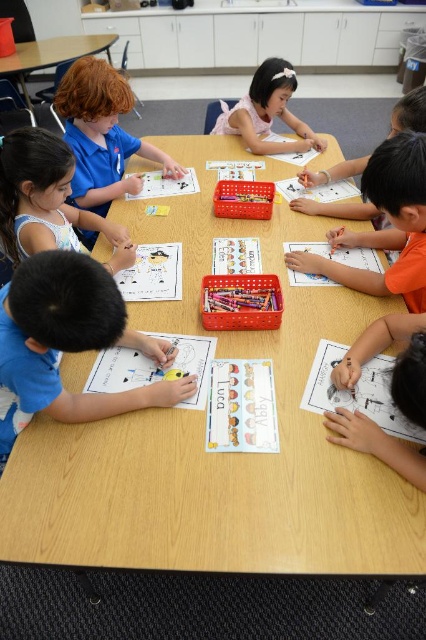
Question: Can you confirm if pink fabric dress at upper center is positioned below wooden table at upper left?

Choices:
 (A) no
 (B) yes

Answer: (B)

Question: Which object is farther from the camera taking this photo?

Choices:
 (A) blue shirt at upper left
 (B) orange matte shirt at right

Answer: (A)

Question: Which object appears closest to the camera in this image?

Choices:
 (A) blue cotton shirt at lower left
 (B) wooden table at center

Answer: (A)

Question: Is blue cotton shirt at lower left positioned behind pink fabric dress at upper center?

Choices:
 (A) yes
 (B) no

Answer: (B)

Question: Does orange matte shirt at right appear on the left side of wooden table at upper left?

Choices:
 (A) yes
 (B) no

Answer: (B)

Question: Which object appears farthest from the camera in this image?

Choices:
 (A) matte blue shirt at left
 (B) pink fabric dress at upper center

Answer: (B)